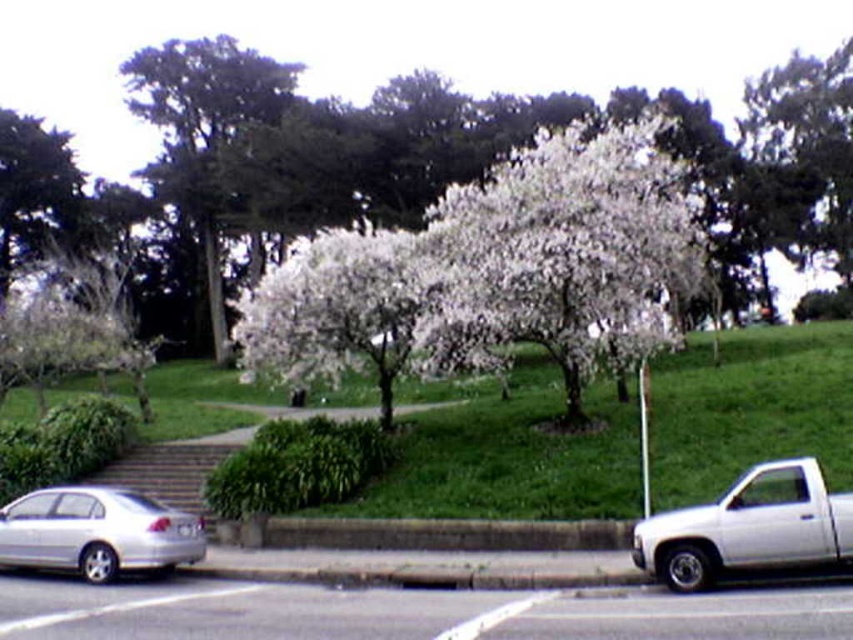
Question: Estimate the real-world distances between objects in this image. Which object is farther from the green leafy tree at upper left?

Choices:
 (A) white blossoms at center
 (B) concrete at lower center

Answer: (B)

Question: Can you confirm if gray asphalt parking lot at lower center is positioned to the left of white matte truck at lower right?

Choices:
 (A) no
 (B) yes

Answer: (B)

Question: Based on their relative distances, which object is farther from the green leafy tree at upper left?

Choices:
 (A) concrete at lower center
 (B) silver metallic sedan at lower left

Answer: (A)

Question: Can you confirm if silver metallic sedan at lower left is positioned below concrete at lower center?

Choices:
 (A) yes
 (B) no

Answer: (B)

Question: Which object appears farthest from the camera in this image?

Choices:
 (A) green leafy tree at upper left
 (B) white blossoms at center
 (C) concrete at lower center

Answer: (A)

Question: Does green leafy tree at upper left come behind silver metallic sedan at lower left?

Choices:
 (A) yes
 (B) no

Answer: (A)